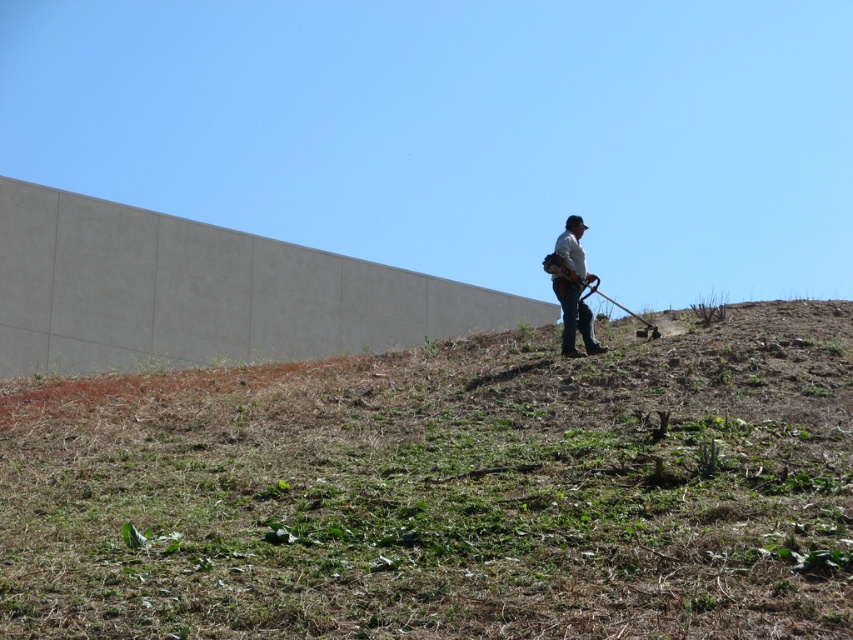
Based on the photo, who is positioned more to the left, green grassy at upper center or white fabric shirt at center?

Positioned to the left is green grassy at upper center.

Between green grassy at upper center and white fabric shirt at center, which one is positioned higher?

Positioned higher is white fabric shirt at center.

Describe the element at coordinates (445, 492) in the screenshot. I see `green grassy at upper center` at that location.

At what (x,y) coordinates should I click in order to perform the action: click on green grassy at upper center. Please return your answer as a coordinate pair (x, y). Looking at the image, I should click on (445, 492).